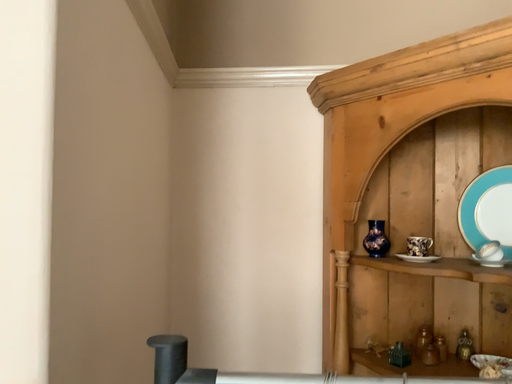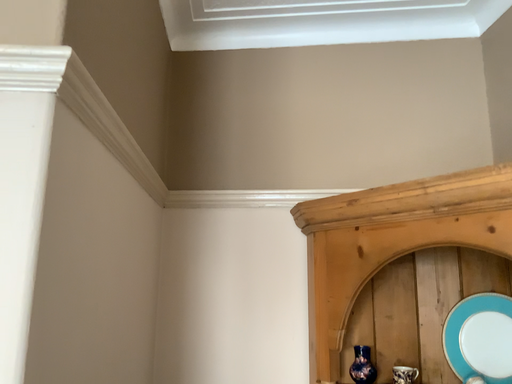
Question: Which way did the camera rotate in the video?

Choices:
 (A) rotated upward
 (B) rotated downward

Answer: (A)